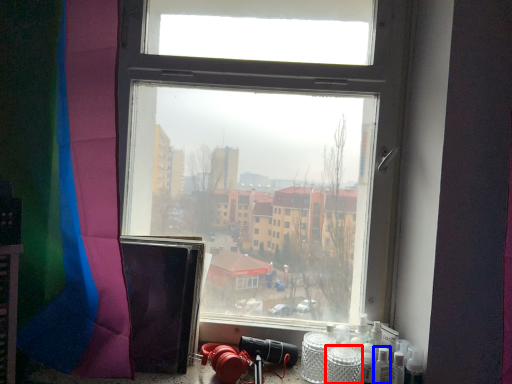
Question: Which point is further to the camera, glass jar (highlighted by a red box) or wine bottle (highlighted by a blue box)?

Choices:
 (A) glass jar
 (B) wine bottle

Answer: (B)